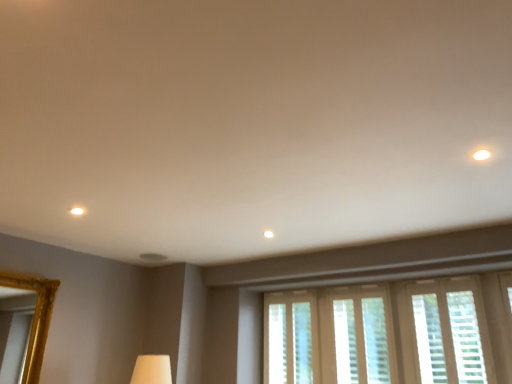
Question: Which direction should I rotate to face translucent plastic blinds at center, marked as the 1th window in a left-to-right arrangement, — up or down?

Choices:
 (A) up
 (B) down

Answer: (B)

Question: Does white textured blinds at lower right, the first window positioned from the right, appear on the left side of translucent plastic blinds at center, marked as the 1th window in a left-to-right arrangement?

Choices:
 (A) no
 (B) yes

Answer: (A)

Question: Is white textured blinds at lower right, the 3th window positioned from the left, further to the viewer compared to translucent plastic blinds at center, marked as the 1th window in a left-to-right arrangement?

Choices:
 (A) yes
 (B) no

Answer: (B)

Question: From a real-world perspective, is white textured blinds at lower right, the first window positioned from the right, located higher than translucent plastic blinds at center, which appears as the third window when viewed from the right?

Choices:
 (A) no
 (B) yes

Answer: (B)

Question: Are white textured blinds at lower right, the 3th window positioned from the left, and translucent plastic blinds at center, which appears as the third window when viewed from the right, far apart?

Choices:
 (A) yes
 (B) no

Answer: (A)

Question: Is white textured blinds at lower right, the 3th window positioned from the left, positioned with its back to translucent plastic blinds at center, marked as the 1th window in a left-to-right arrangement?

Choices:
 (A) no
 (B) yes

Answer: (A)

Question: Is white textured blinds at lower right, the first window positioned from the right, not inside translucent plastic blinds at center, marked as the 1th window in a left-to-right arrangement?

Choices:
 (A) no
 (B) yes

Answer: (B)

Question: From a real-world perspective, is translucent plastic blinds at center, which appears as the third window when viewed from the right, positioned under white textured blinds at lower right, the first window positioned from the right, based on gravity?

Choices:
 (A) no
 (B) yes

Answer: (B)

Question: Is translucent plastic blinds at center, which appears as the third window when viewed from the right, thinner than white textured blinds at lower right, the first window positioned from the right?

Choices:
 (A) yes
 (B) no

Answer: (B)

Question: Is white textured blinds at lower right, the first window positioned from the right, a part of translucent plastic blinds at center, marked as the 1th window in a left-to-right arrangement?

Choices:
 (A) no
 (B) yes

Answer: (A)

Question: Considering the relative sizes of translucent plastic blinds at center, marked as the 1th window in a left-to-right arrangement, and white textured blinds at lower right, the first window positioned from the right, in the image provided, is translucent plastic blinds at center, marked as the 1th window in a left-to-right arrangement, shorter than white textured blinds at lower right, the first window positioned from the right,?

Choices:
 (A) yes
 (B) no

Answer: (B)

Question: From the image's perspective, does translucent plastic blinds at center, marked as the 1th window in a left-to-right arrangement, appear higher than white textured blinds at lower right, the first window positioned from the right?

Choices:
 (A) no
 (B) yes

Answer: (A)

Question: Is translucent plastic blinds at center, which appears as the third window when viewed from the right, positioned beyond the bounds of white textured blinds at lower right, the first window positioned from the right?

Choices:
 (A) yes
 (B) no

Answer: (A)

Question: From a real-world perspective, is translucent plastic blinds at center, which appears as the third window when viewed from the right, on top of translucent plastic blinds at lower center, which appears as the 2th window when viewed from the left?

Choices:
 (A) yes
 (B) no

Answer: (B)